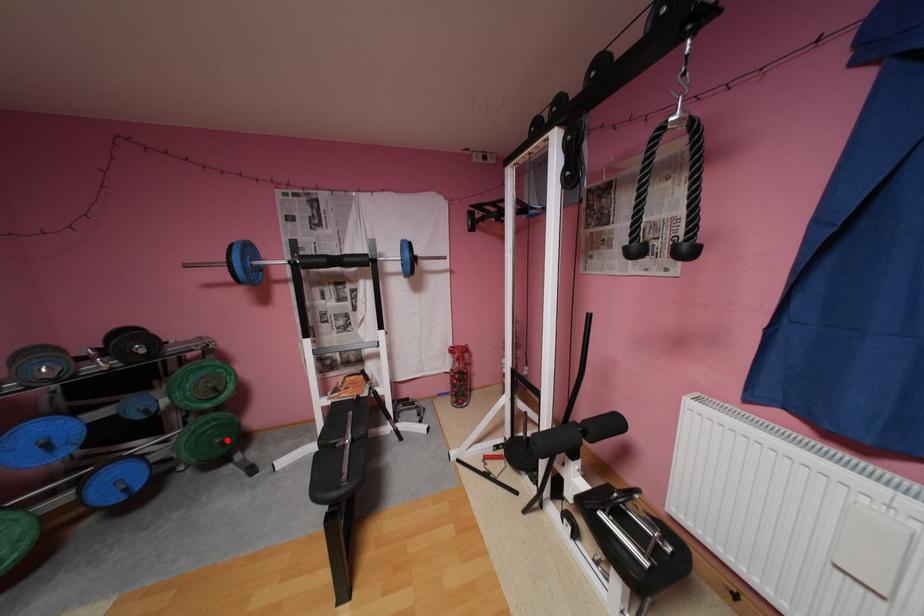
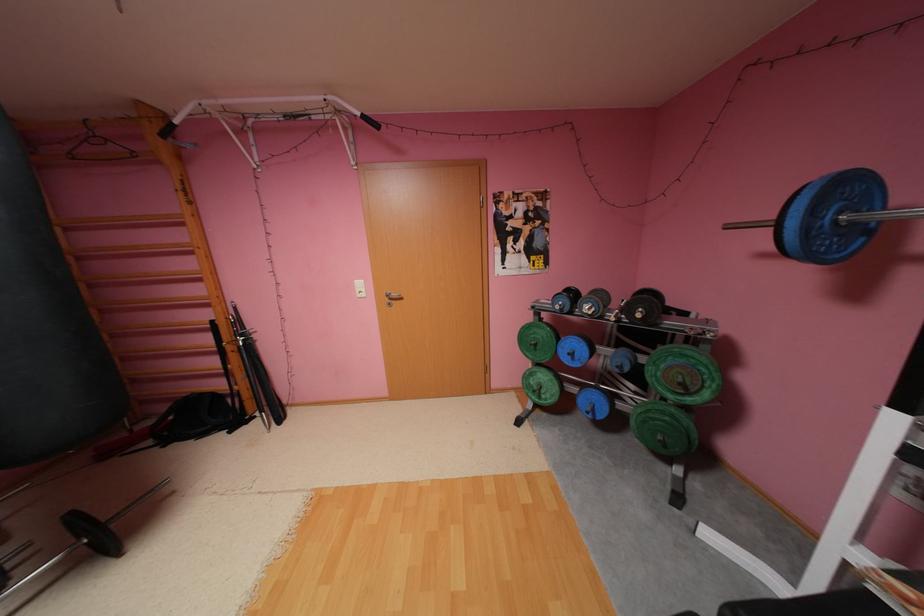
Question: I am providing you with two images of the same scene from different viewpoints. A red point is shown in image1. For the corresponding object point in image2, is it positioned nearer or farther from the camera?

Choices:
 (A) Nearer
 (B) Farther

Answer: (B)